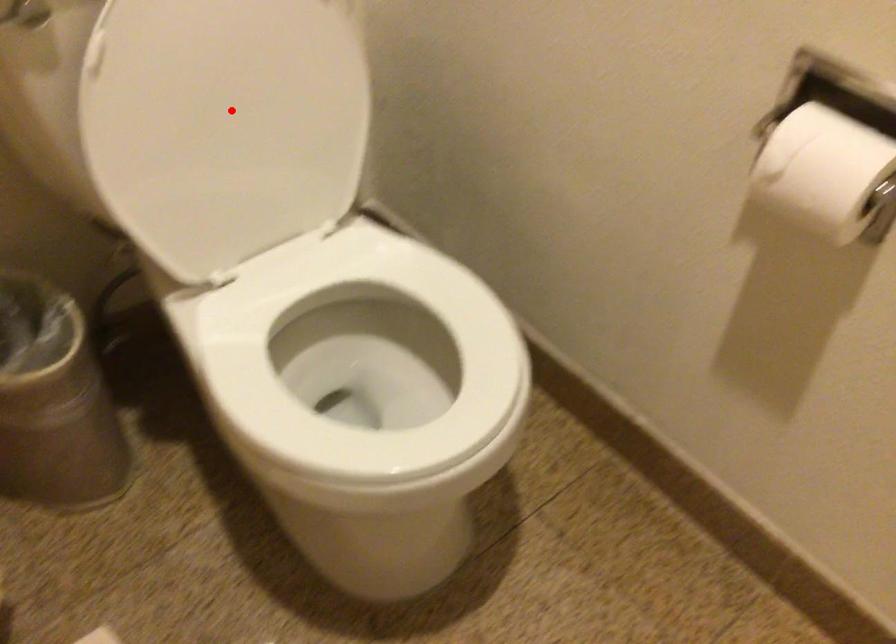
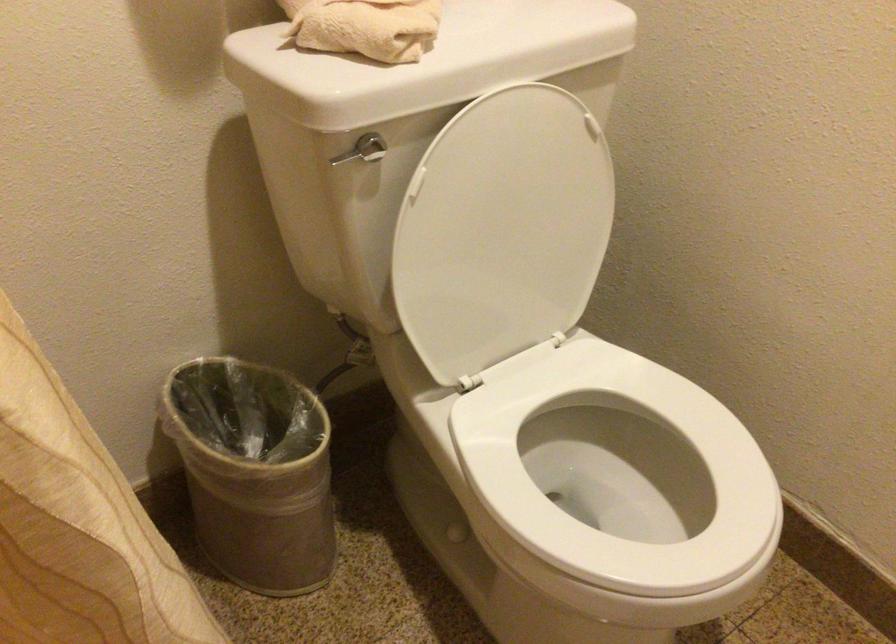
Locate, in the second image, the point that corresponds to the highlighted location in the first image.

(502, 230)